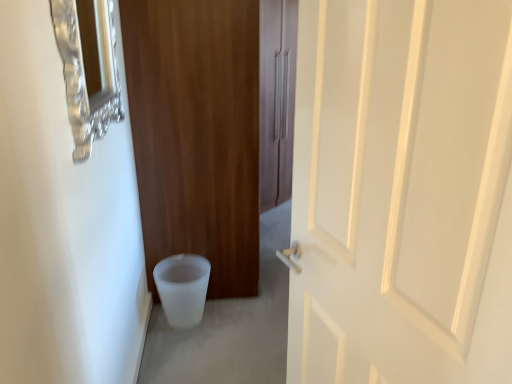
Question: From a real-world perspective, is white matte door at center, the 1th door from the front, positioned under white frosted toilet bowl at lower left based on gravity?

Choices:
 (A) yes
 (B) no

Answer: (B)

Question: Can you confirm if white matte door at center, which is the 2th door from back to front, is shorter than white frosted toilet bowl at lower left?

Choices:
 (A) no
 (B) yes

Answer: (A)

Question: Does white matte door at center, which is the 2th door from back to front, have a smaller size compared to white frosted toilet bowl at lower left?

Choices:
 (A) yes
 (B) no

Answer: (B)

Question: Is there a large distance between white matte door at center, which is the 2th door from back to front, and white frosted toilet bowl at lower left?

Choices:
 (A) no
 (B) yes

Answer: (B)

Question: From a real-world perspective, does white matte door at center, the 1th door from the front, stand above white frosted toilet bowl at lower left?

Choices:
 (A) yes
 (B) no

Answer: (A)

Question: Considering the relative sizes of white matte door at center, which is the 2th door from back to front, and white frosted toilet bowl at lower left in the image provided, is white matte door at center, which is the 2th door from back to front, bigger than white frosted toilet bowl at lower left?

Choices:
 (A) no
 (B) yes

Answer: (B)

Question: Can you confirm if brushed metal medicine cabinet at upper left is positioned to the left of matte wood door at center, acting as the second door starting from the front?

Choices:
 (A) yes
 (B) no

Answer: (A)

Question: Is brushed metal medicine cabinet at upper left positioned in front of matte wood door at center, acting as the first door starting from the back?

Choices:
 (A) yes
 (B) no

Answer: (A)

Question: From the image's perspective, is brushed metal medicine cabinet at upper left on top of matte wood door at center, acting as the second door starting from the front?

Choices:
 (A) no
 (B) yes

Answer: (A)

Question: Can you confirm if brushed metal medicine cabinet at upper left is positioned to the right of matte wood door at center, acting as the second door starting from the front?

Choices:
 (A) yes
 (B) no

Answer: (B)

Question: Is brushed metal medicine cabinet at upper left behind matte wood door at center, acting as the second door starting from the front?

Choices:
 (A) yes
 (B) no

Answer: (B)

Question: Is brushed metal medicine cabinet at upper left positioned with its back to matte wood door at center, acting as the second door starting from the front?

Choices:
 (A) no
 (B) yes

Answer: (A)

Question: Is the surface of white frosted toilet bowl at lower left in direct contact with matte wood door at center, acting as the first door starting from the back?

Choices:
 (A) no
 (B) yes

Answer: (A)